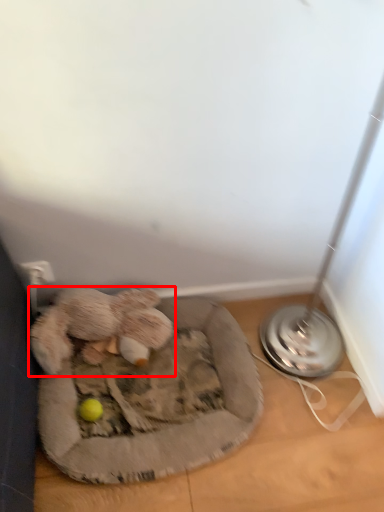
Question: Considering the relative positions of toy (annotated by the red box) and dog bed in the image provided, where is toy (annotated by the red box) located with respect to the staircase?

Choices:
 (A) right
 (B) left

Answer: (B)